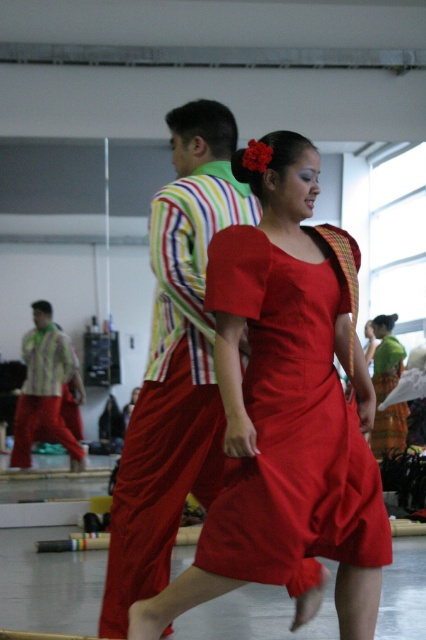
Is matte red dress at center shorter than silky green dress at lower right?

Yes.

Between point (345, 502) and point (391, 316), which one is positioned behind?

Point (391, 316)

Identify the location of matte red dress at center. (290, 424).

Is striped cotton shirt at left to the right of silky green dress at lower right from the viewer's perspective?

Incorrect, striped cotton shirt at left is not on the right side of silky green dress at lower right.

Can you confirm if striped cotton shirt at left is wider than silky green dress at lower right?

Yes, striped cotton shirt at left is wider than silky green dress at lower right.

Is point (25, 458) in front of point (379, 442)?

Yes, point (25, 458) is closer to viewer.

What are the coordinates of `striped cotton shirt at left` in the screenshot? It's located at (46, 388).

Between matte red dress at center and striped cotton shirt at left, which one has more height?

Standing taller between the two is striped cotton shirt at left.

Who is positioned more to the right, matte red dress at center or striped cotton shirt at left?

matte red dress at center is more to the right.

Is point (308, 474) in front of point (34, 317)?

Yes, it is.

Where is `matte red dress at center`? The width and height of the screenshot is (426, 640). matte red dress at center is located at coordinates (290, 424).